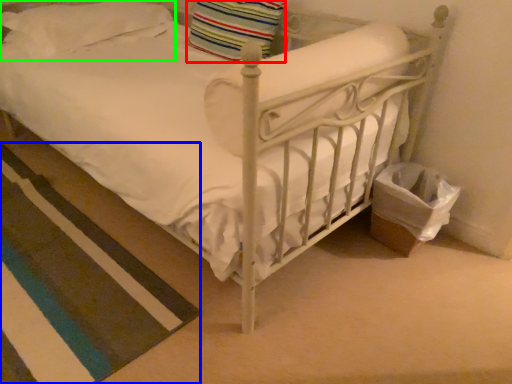
Question: Which object is positioned closest to pillow (highlighted by a red box)? Select from strip (highlighted by a blue box) and pillow (highlighted by a green box).

Choices:
 (A) strip
 (B) pillow

Answer: (B)